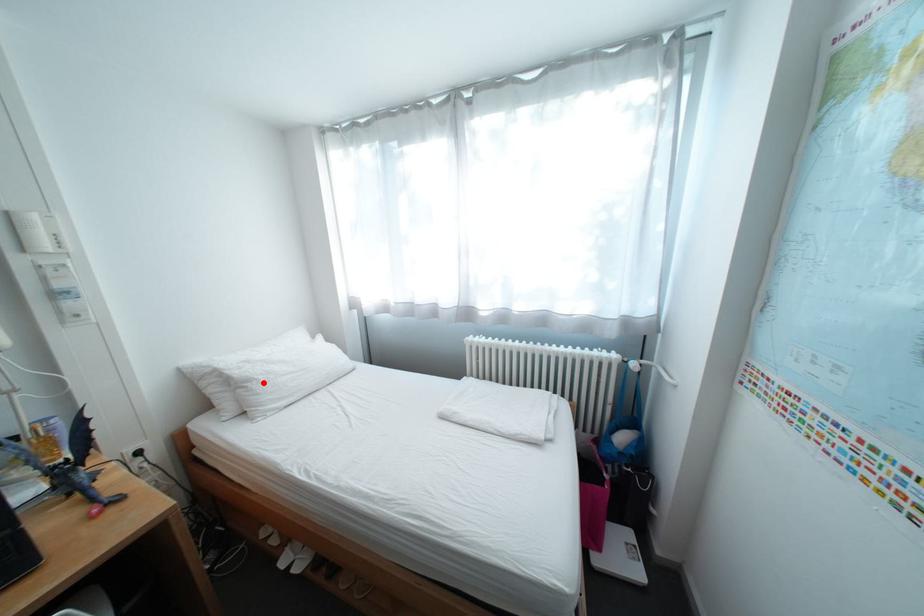
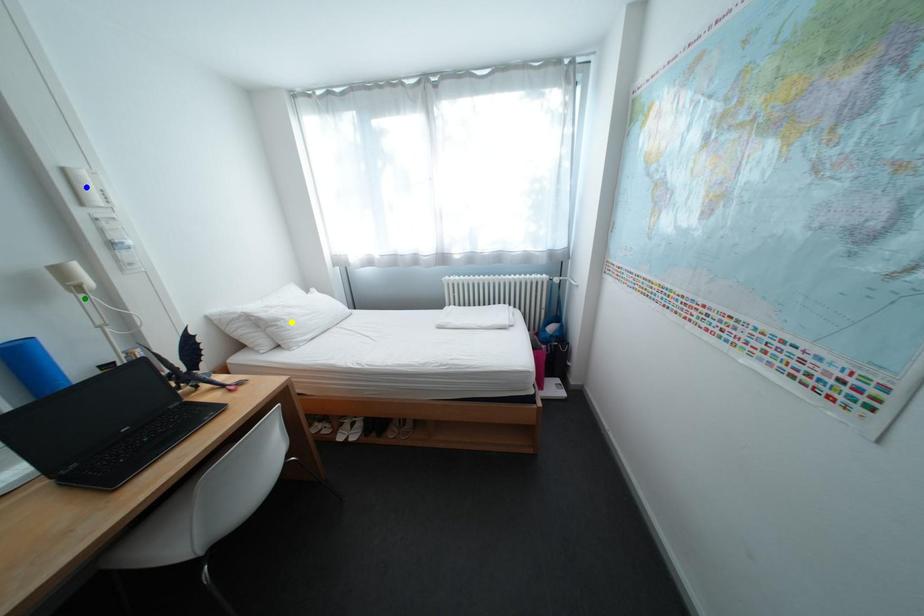
Question: I am providing you with two images of the same scene from different viewpoints. A red point is marked on the first image. You are given multiple points on the second image. Which spot in image 2 lines up with the point in image 1?

Choices:
 (A) green point
 (B) blue point
 (C) yellow point

Answer: (C)